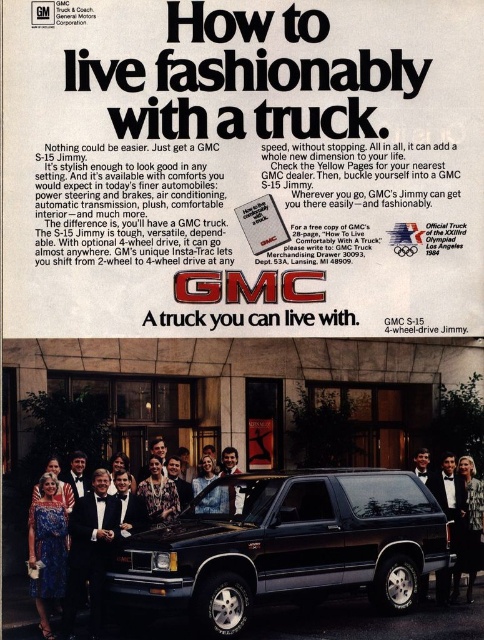
Can you confirm if matte black dress at lower left is thinner than smooth leather jacket at center?

Incorrect, matte black dress at lower left's width is not less than smooth leather jacket at center's.

Which is more to the left, matte black dress at lower left or smooth leather jacket at center?

From the viewer's perspective, matte black dress at lower left appears more on the left side.

Looking at this image, who is more distant from viewer, (195,496) or (240,509)?

The point (195,496) is more distant.

The image size is (484, 640). I want to click on matte black dress at lower left, so [x=118, y=532].

Find the location of `matte black dress at lower left`. matte black dress at lower left is located at coordinates (118, 532).

Is black satin tuxedo at center shorter than floral dress at center?

In fact, black satin tuxedo at center may be taller than floral dress at center.

Who is more distant from viewer, (72, 531) or (167, 497)?

Point (167, 497)

Measure the distance between point (x=70, y=531) and camera.

A distance of 194.78 feet exists between point (x=70, y=531) and camera.

The width and height of the screenshot is (484, 640). I want to click on black satin tuxedo at center, so click(90, 552).